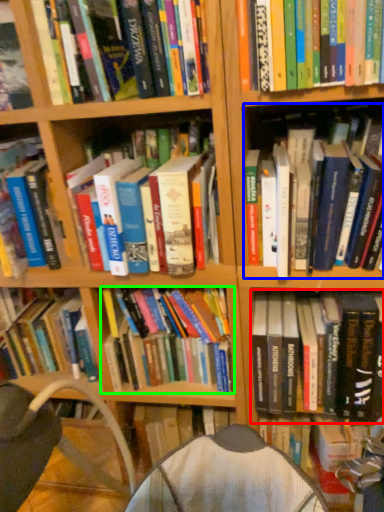
Question: Which object is the farthest from book (highlighted by a red box)? Choose among these: book (highlighted by a blue box) or book (highlighted by a green box).

Choices:
 (A) book
 (B) book

Answer: (A)